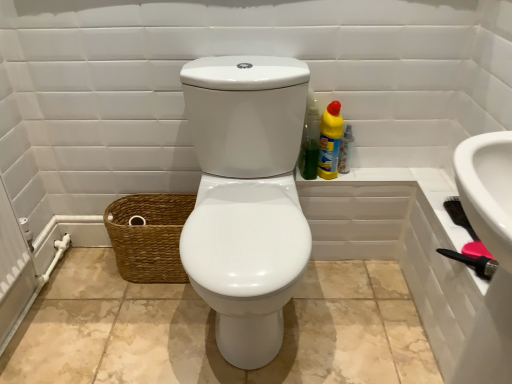
Locate an element on the screen. vacant area that lies in front of brown woven basket at lower left is located at coordinates (144, 310).